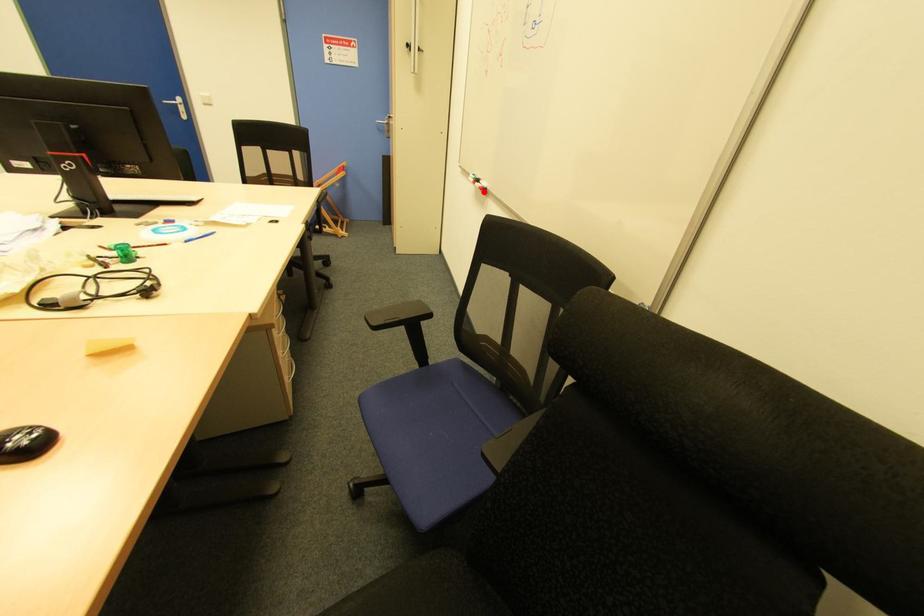
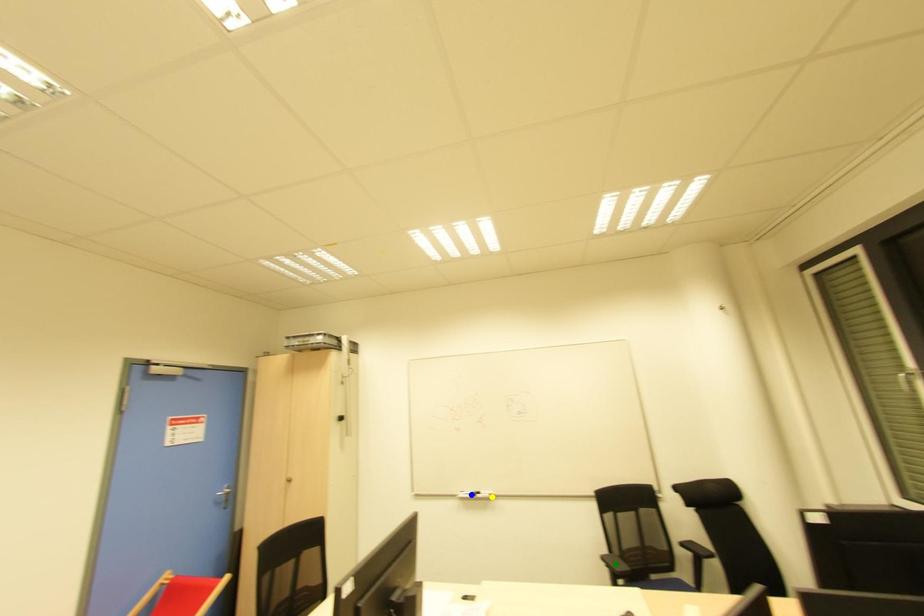
Question: I am providing you with two images of the same scene from different viewpoints. A red point is marked on the first image. You are given multiple points on the second image. Which spot in image 2 lines up with the point in image 1?

Choices:
 (A) blue point
 (B) green point
 (C) yellow point

Answer: (C)